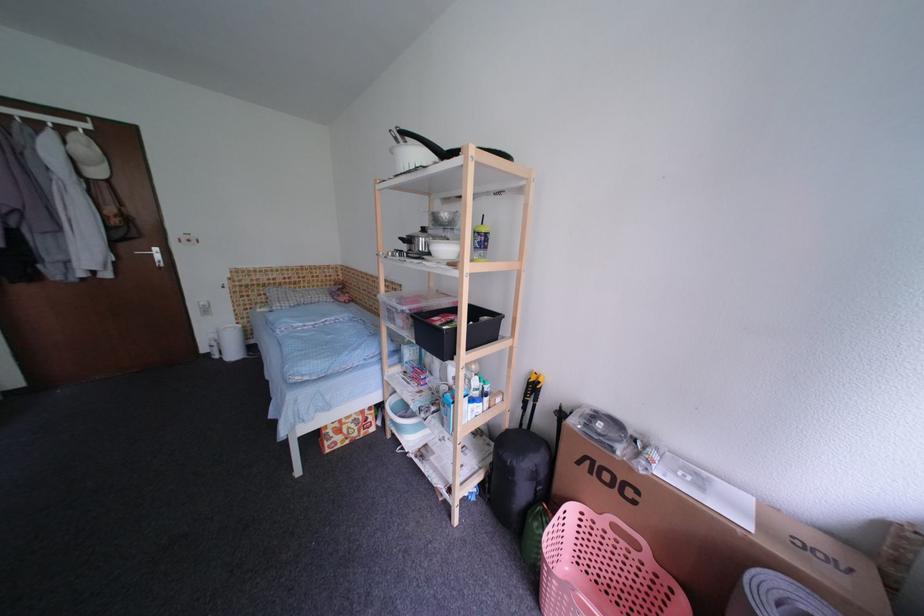
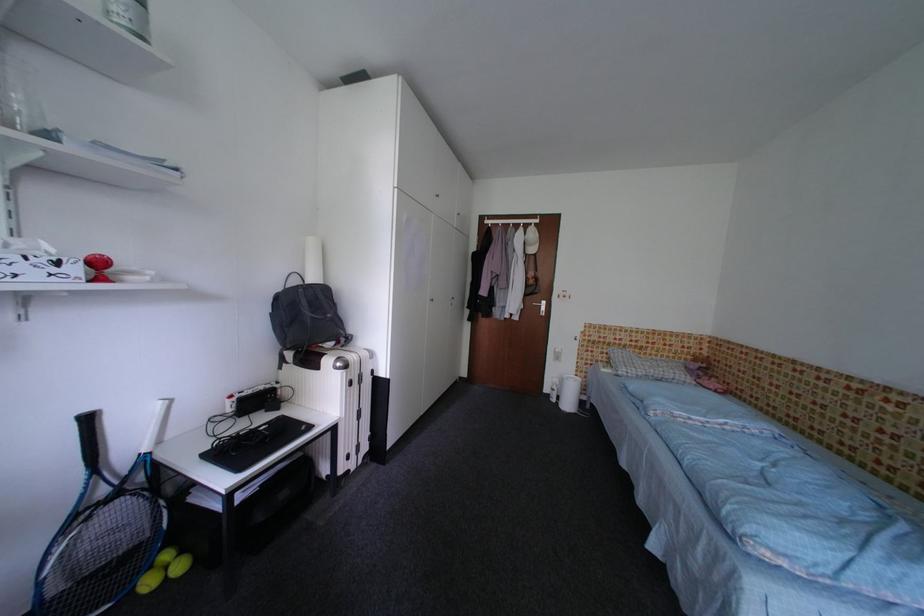
The point at (325, 288) is marked in the first image. Where is the corresponding point in the second image?

(675, 360)